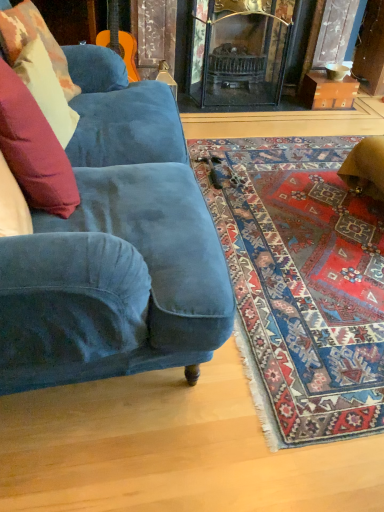
I want to click on vacant area that is in front of brown cardboard box at upper right, so click(x=334, y=122).